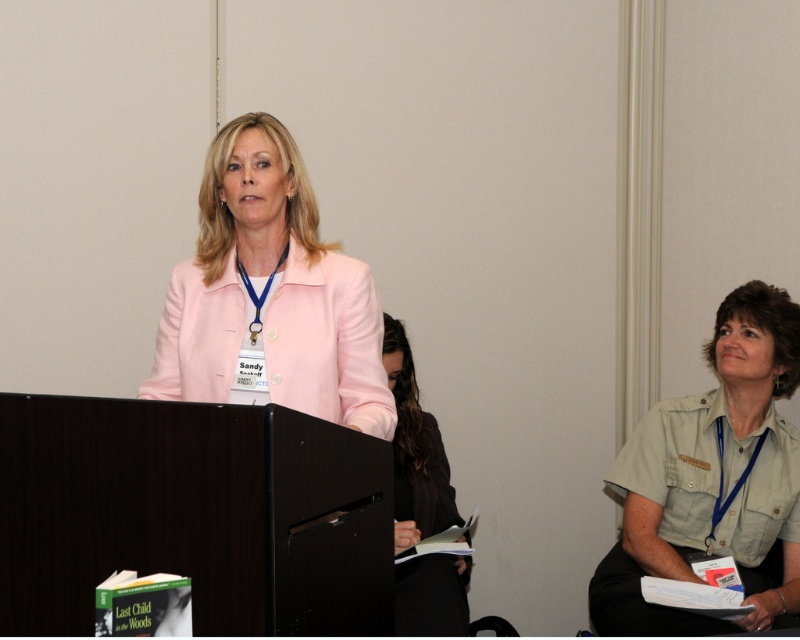
You are an event organizer checking the seating arrangement. There is a pink fabric jacket at center and a khaki uniform at right. Which clothing item is shorter in height?

The pink fabric jacket at center is not as tall as the khaki uniform at right, so the pink fabric jacket at center is shorter in height.

From the picture: What is located at the coordinates point (270,296)?

The pink fabric jacket at center is located at point (270,296).